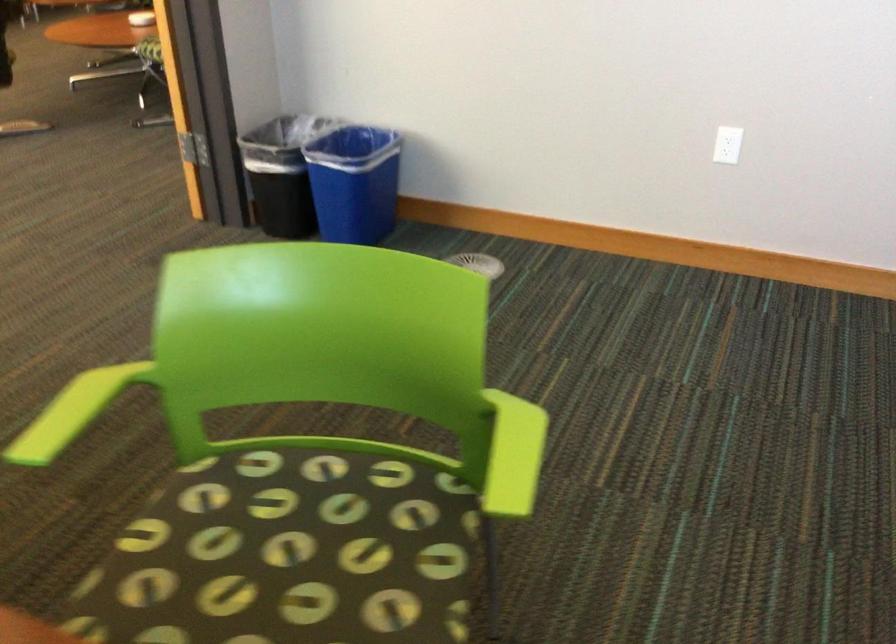
Which object does [281,174] point to?

It corresponds to the black trash can in the image.